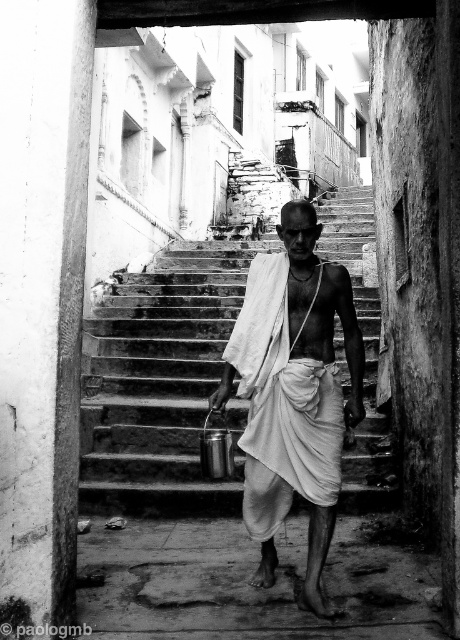
Question: Can you confirm if stone stairs at center is positioned above white clothed man at center?

Choices:
 (A) yes
 (B) no

Answer: (A)

Question: Which point is farther to the camera?

Choices:
 (A) white clothed man at center
 (B) stone stairs at center

Answer: (B)

Question: Does stone stairs at center lie behind white clothed man at center?

Choices:
 (A) yes
 (B) no

Answer: (A)

Question: Does stone stairs at center appear over white clothed man at center?

Choices:
 (A) no
 (B) yes

Answer: (B)